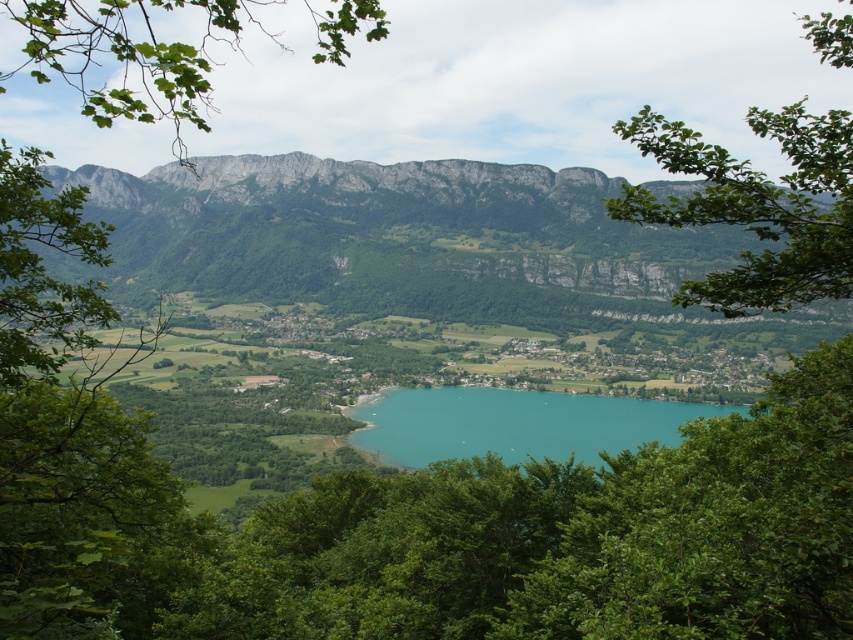
You are an outdoor photographer planning to capture a landscape photo that includes both the gray rocky mountain at center and the green leafy branch at upper right. Based on their sizes, which object should you focus on to ensure it occupies a larger portion of your photo?

The gray rocky mountain at center might be wider than green leafy branch at upper right, so focusing on the gray rocky mountain at center would likely result in it occupying a larger portion of the photo.

You are an observer looking at the landscape. Which object appears closer to you between the green leafy branch at upper right and the turquoise glassy water at center?

The green leafy branch at upper right appears closer because it is positioned in front of the turquoise glassy water at center.

You are a photographer planning to capture the gray rocky mountain at center in your shot. Based on the scene description, where should you position your camera to ensure the mountain is centered in the frame?

To center the gray rocky mountain at center in your frame, position your camera so that the mountain is aligned with the point at coordinates 0.369 on the x axis and 0.463 on the y axis.